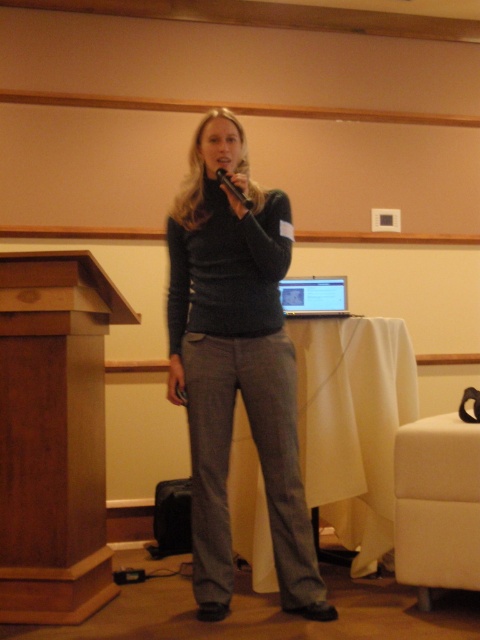
Question: Among these objects, which one is farthest from the camera?

Choices:
 (A) wooden podium at left
 (B) dark gray sweater at center
 (C) black matte microphone at center

Answer: (A)

Question: Does dark gray sweater at center have a greater width compared to black matte microphone at center?

Choices:
 (A) no
 (B) yes

Answer: (B)

Question: Does white fabric armchair at lower right appear under pink matte lips at center?

Choices:
 (A) yes
 (B) no

Answer: (A)

Question: Can you confirm if wooden podium at left is smaller than silver metallic laptop at center?

Choices:
 (A) no
 (B) yes

Answer: (A)

Question: Which point is farther to the camera?

Choices:
 (A) wooden podium at left
 (B) white fabric armchair at lower right

Answer: (A)

Question: Which object is positioned closest to the pink matte lips at center?

Choices:
 (A) black matte microphone at center
 (B) dark gray sweater at center
 (C) white fabric armchair at lower right
 (D) wooden podium at left

Answer: (A)